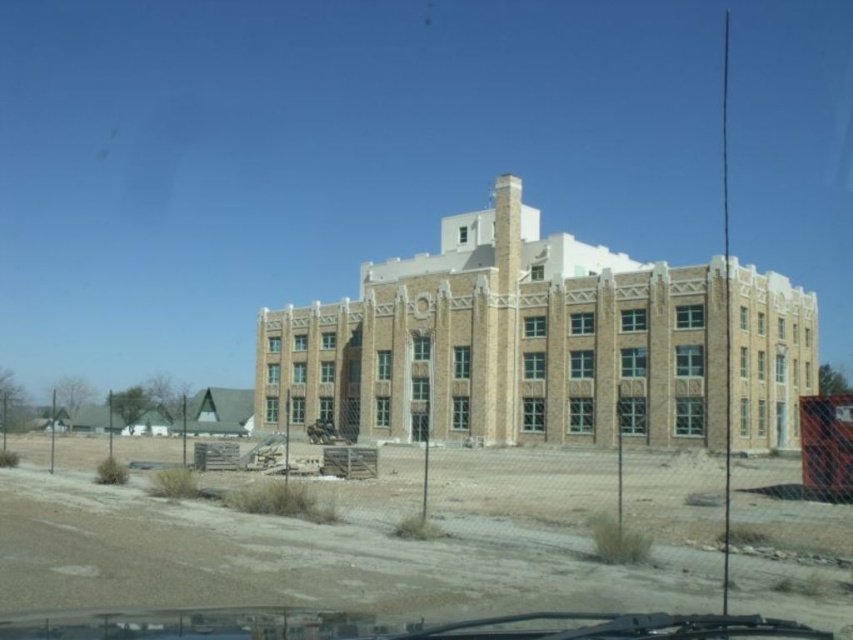
Between dirt field at lower left and beige brick building at center, which one appears on the left side from the viewer's perspective?

Positioned to the left is dirt field at lower left.

Between point (635, 474) and point (698, 435), which one is positioned behind?

Positioned behind is point (698, 435).

Find the location of `dirt field at lower left`. dirt field at lower left is located at coordinates (369, 534).